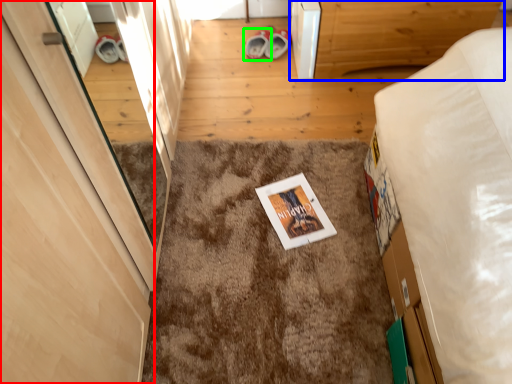
Question: Which is farther away from door (highlighted by a red box)? furniture (highlighted by a blue box) or footwear (highlighted by a green box)?

Choices:
 (A) furniture
 (B) footwear

Answer: (B)